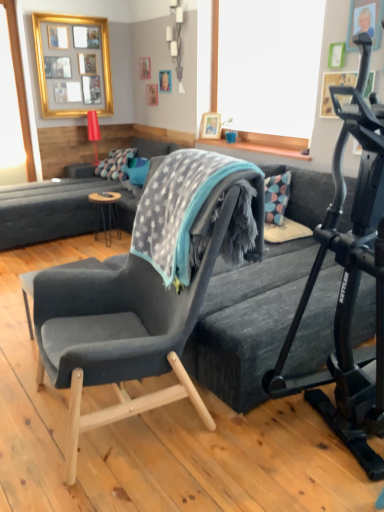
Question: Is gray fleece blanket at center not near multicolored fabric pillow at center, positioned as the second pillow in right-to-left order?

Choices:
 (A) no
 (B) yes

Answer: (B)

Question: Is gray fleece blanket at center shorter than multicolored fabric pillow at center, positioned as the second pillow in right-to-left order?

Choices:
 (A) no
 (B) yes

Answer: (A)

Question: Is gray fleece blanket at center positioned with its back to multicolored fabric pillow at center, positioned as the 1th pillow in left-to-right order?

Choices:
 (A) no
 (B) yes

Answer: (A)

Question: Does gray fleece blanket at center have a greater height compared to multicolored fabric pillow at center, positioned as the second pillow in right-to-left order?

Choices:
 (A) yes
 (B) no

Answer: (A)

Question: Is gray fleece blanket at center behind multicolored fabric pillow at center, positioned as the 1th pillow in left-to-right order?

Choices:
 (A) no
 (B) yes

Answer: (A)

Question: Relative to wooden black table at center, is teal fabric pillow at center, which is the 1th pillow from right to left, in front or behind?

Choices:
 (A) behind
 (B) front

Answer: (A)

Question: Is teal fabric pillow at center, acting as the second pillow starting from the left, spatially inside wooden black table at center, or outside of it?

Choices:
 (A) inside
 (B) outside

Answer: (B)

Question: From the image's perspective, is teal fabric pillow at center, which is the 1th pillow from right to left, located above or below wooden black table at center?

Choices:
 (A) below
 (B) above

Answer: (B)

Question: Does point (130, 180) appear closer or farther from the camera than point (100, 197)?

Choices:
 (A) closer
 (B) farther

Answer: (B)

Question: Is point (11, 210) positioned closer to the camera than point (34, 20)?

Choices:
 (A) closer
 (B) farther

Answer: (A)

Question: Looking at the image, does velvet dark gray couch at center seem bigger or smaller compared to gold metallic picture frame at upper left?

Choices:
 (A) big
 (B) small

Answer: (A)

Question: Relative to gold metallic picture frame at upper left, is velvet dark gray couch at center in front or behind?

Choices:
 (A) behind
 (B) front

Answer: (B)

Question: From a real-world perspective, is velvet dark gray couch at center above or below gold metallic picture frame at upper left?

Choices:
 (A) below
 (B) above

Answer: (A)

Question: Based on their sizes in the image, would you say black metal treadmill at right is bigger or smaller than multicolored fabric pillow at center, positioned as the 1th pillow in left-to-right order?

Choices:
 (A) small
 (B) big

Answer: (B)

Question: Does point (360, 217) appear closer or farther from the camera than point (122, 153)?

Choices:
 (A) farther
 (B) closer

Answer: (B)